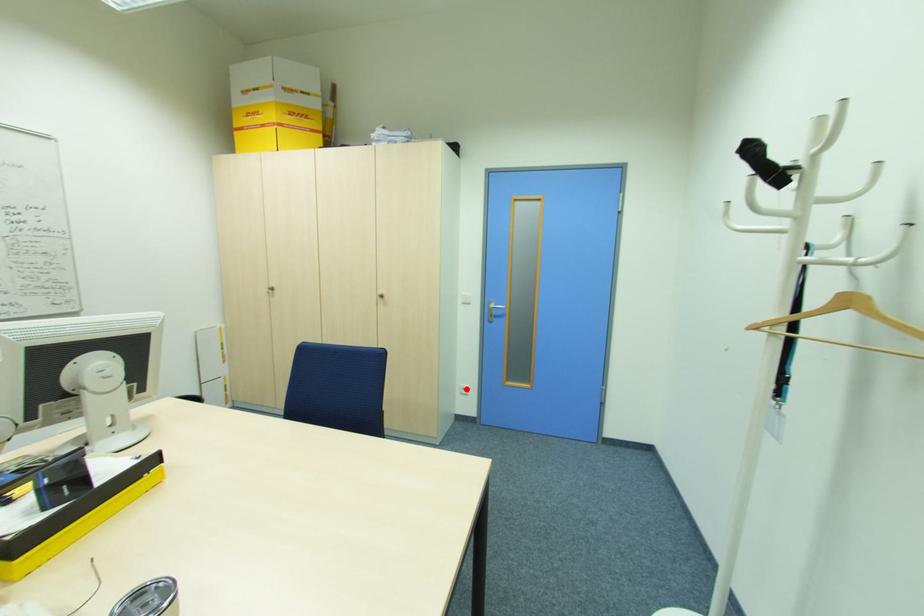
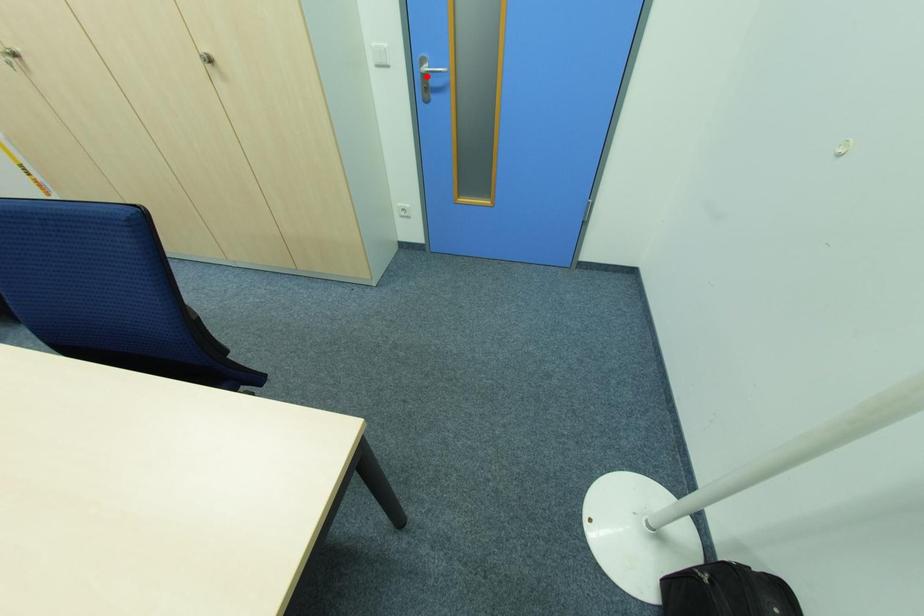
I am providing you with two images of the same scene from different viewpoints. A red point is marked on the first image and another point is marked on the second image. Do the highlighted points in image1 and image2 indicate the same real-world spot?

No